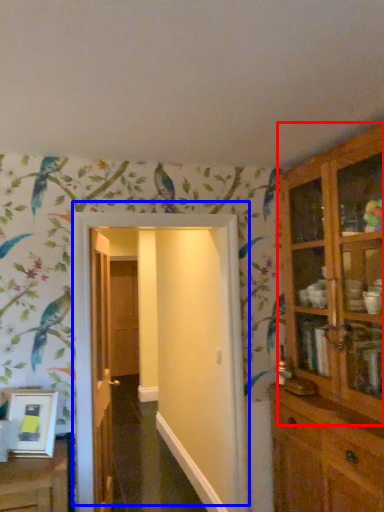
Question: Among these objects, which one is farthest to the camera, cupboard (highlighted by a red box) or door (highlighted by a blue box)?

Choices:
 (A) cupboard
 (B) door

Answer: (B)